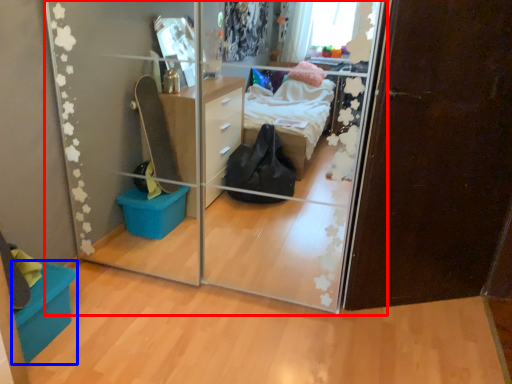
Question: Which object is closer to the camera taking this photo, glass door (highlighted by a red box) or storage box (highlighted by a blue box)?

Choices:
 (A) glass door
 (B) storage box

Answer: (A)